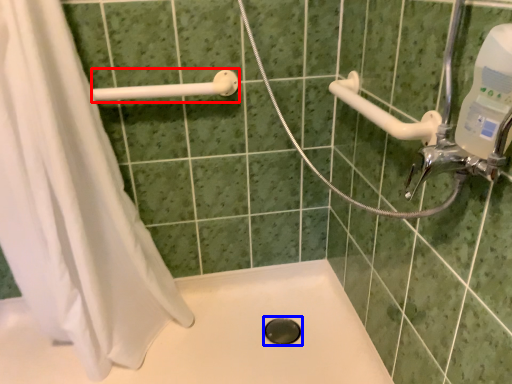
Question: Which object is closer to the camera taking this photo, shower (highlighted by a red box) or hole (highlighted by a blue box)?

Choices:
 (A) shower
 (B) hole

Answer: (A)